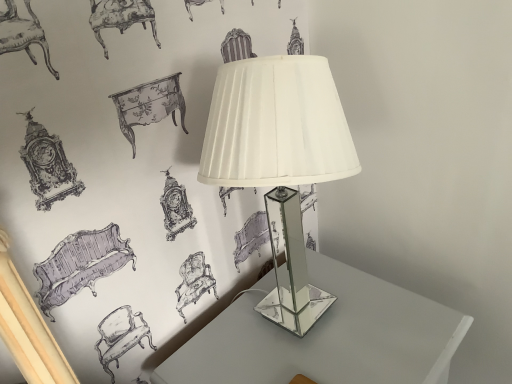
Question: Is clear glass table at center to the left of clear glass lamp at center from the viewer's perspective?

Choices:
 (A) yes
 (B) no

Answer: (B)

Question: Is clear glass table at center oriented towards clear glass lamp at center?

Choices:
 (A) no
 (B) yes

Answer: (A)

Question: Can we say clear glass table at center lies outside clear glass lamp at center?

Choices:
 (A) no
 (B) yes

Answer: (B)

Question: Does clear glass table at center have a lesser height compared to clear glass lamp at center?

Choices:
 (A) no
 (B) yes

Answer: (A)

Question: Can you confirm if clear glass table at center is taller than clear glass lamp at center?

Choices:
 (A) no
 (B) yes

Answer: (B)

Question: Can you confirm if clear glass table at center is thinner than clear glass lamp at center?

Choices:
 (A) yes
 (B) no

Answer: (B)

Question: Is the position of clear glass lamp at center less distant than that of clear glass table at center?

Choices:
 (A) yes
 (B) no

Answer: (A)

Question: Is the position of clear glass lamp at center more distant than that of clear glass table at center?

Choices:
 (A) yes
 (B) no

Answer: (B)

Question: From the image's perspective, is clear glass lamp at center located above clear glass table at center?

Choices:
 (A) no
 (B) yes

Answer: (B)

Question: Can you confirm if clear glass lamp at center is wider than clear glass table at center?

Choices:
 (A) yes
 (B) no

Answer: (B)

Question: Considering the relative positions of clear glass lamp at center and clear glass table at center in the image provided, is clear glass lamp at center to the left of clear glass table at center from the viewer's perspective?

Choices:
 (A) yes
 (B) no

Answer: (A)

Question: Is clear glass table at center a part of clear glass lamp at center?

Choices:
 (A) yes
 (B) no

Answer: (B)

Question: In the image, is clear glass table at center on the left side or the right side of clear glass lamp at center?

Choices:
 (A) left
 (B) right

Answer: (B)